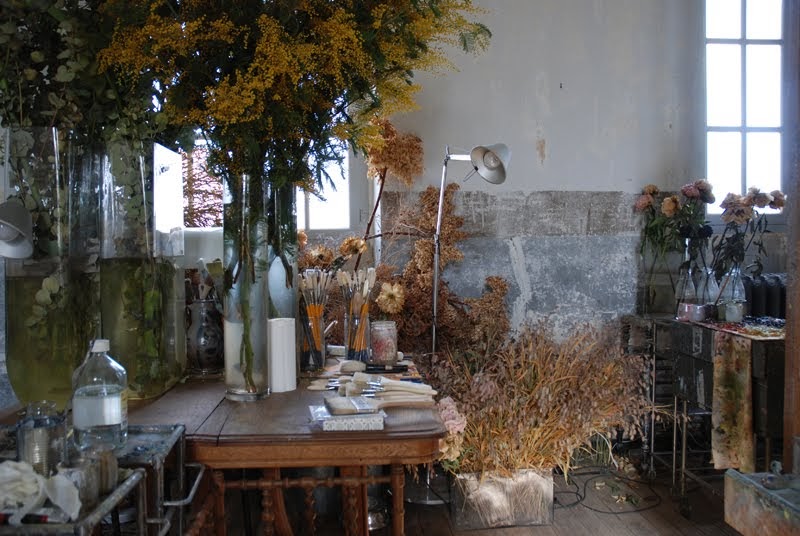
Locate an element on the screen. table is located at coordinates (244, 421), (298, 451).